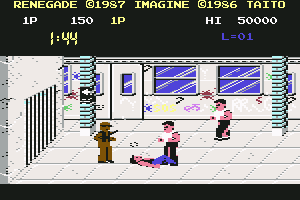
Identify the location of windows. pos(181,86), pos(238,83).